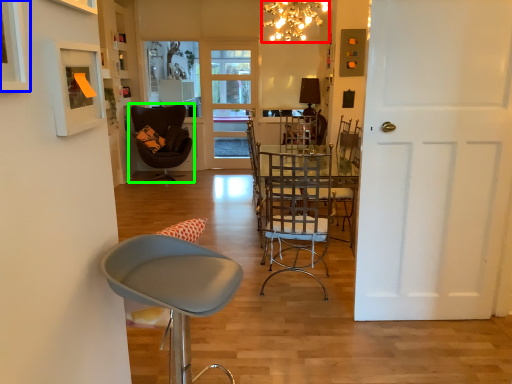
Question: Considering the real-world distances, which object is closest to lamp (highlighted by a red box)? picture frame (highlighted by a blue box) or chair (highlighted by a green box).

Choices:
 (A) picture frame
 (B) chair

Answer: (B)